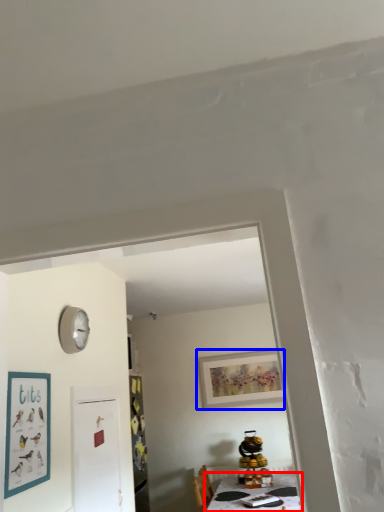
Question: Which of the following is the farthest to the observer, table (highlighted by a red box) or picture frame (highlighted by a blue box)?

Choices:
 (A) table
 (B) picture frame

Answer: (B)